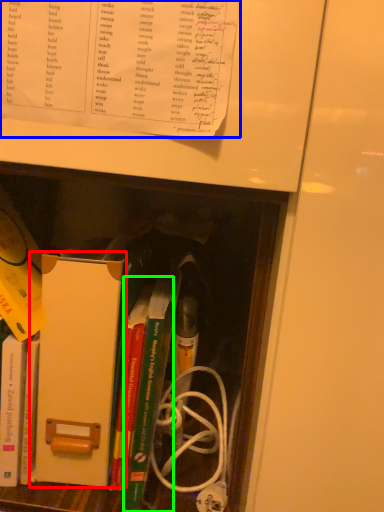
Question: Based on their relative distances, which object is farther from paperback book (highlighted by a red box)? Choose from book (highlighted by a blue box) and book (highlighted by a green box).

Choices:
 (A) book
 (B) book

Answer: (A)